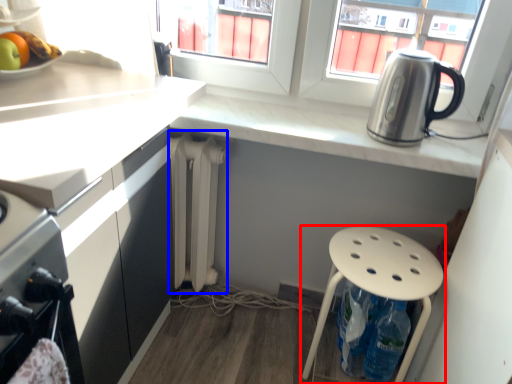
Question: Which point is further to the camera, stool (highlighted by a red box) or radiator (highlighted by a blue box)?

Choices:
 (A) stool
 (B) radiator

Answer: (B)